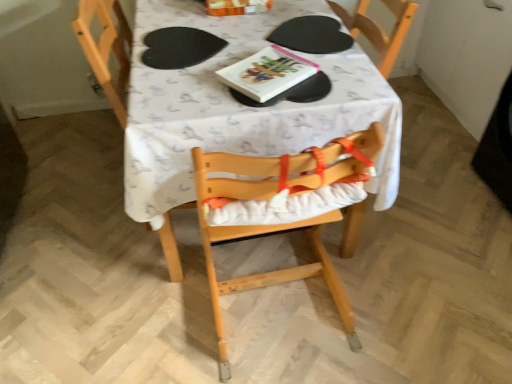
This screenshot has height=384, width=512. What are the coordinates of `vacant region to the right of natural wood highchair at center` in the screenshot? It's located at (396, 288).